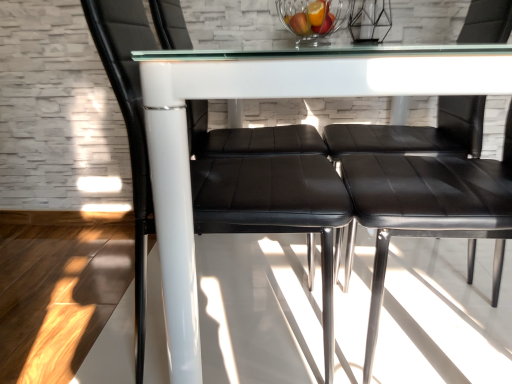
Question: Is transparent glass table at center directly adjacent to black leather chair at left, which is the second chair in right-to-left order?

Choices:
 (A) no
 (B) yes

Answer: (A)

Question: Does transparent glass table at center have a greater width compared to black leather chair at left, positioned as the first chair in left-to-right order?

Choices:
 (A) no
 (B) yes

Answer: (B)

Question: Does transparent glass table at center appear on the left side of black leather chair at left, which is the second chair in right-to-left order?

Choices:
 (A) no
 (B) yes

Answer: (A)

Question: Does transparent glass table at center turn towards black leather chair at left, which is the second chair in right-to-left order?

Choices:
 (A) yes
 (B) no

Answer: (A)

Question: From a real-world perspective, is transparent glass table at center located beneath black leather chair at left, positioned as the first chair in left-to-right order?

Choices:
 (A) yes
 (B) no

Answer: (A)

Question: Would you say clear glass bowl at upper center is to the left or to the right of black leather chair at center, which is the 1th chair from right to left, in the picture?

Choices:
 (A) right
 (B) left

Answer: (B)

Question: Is clear glass bowl at upper center inside the boundaries of black leather chair at center, positioned as the second chair in left-to-right order, or outside?

Choices:
 (A) inside
 (B) outside

Answer: (B)

Question: From the image's perspective, is clear glass bowl at upper center located above or below black leather chair at center, positioned as the second chair in left-to-right order?

Choices:
 (A) above
 (B) below

Answer: (A)

Question: In terms of size, does clear glass bowl at upper center appear bigger or smaller than black leather chair at center, which is the 1th chair from right to left?

Choices:
 (A) small
 (B) big

Answer: (A)

Question: From a real-world perspective, is transparent glass table at center above or below clear glass bowl at upper center?

Choices:
 (A) above
 (B) below

Answer: (B)

Question: Is point (197, 51) closer or farther from the camera than point (284, 1)?

Choices:
 (A) farther
 (B) closer

Answer: (B)

Question: Is transparent glass table at center bigger or smaller than clear glass bowl at upper center?

Choices:
 (A) big
 (B) small

Answer: (A)

Question: Looking at their shapes, would you say transparent glass table at center is wider or thinner than clear glass bowl at upper center?

Choices:
 (A) wide
 (B) thin

Answer: (A)

Question: Is transparent glass table at center bigger or smaller than black leather chair at left, which is the second chair in right-to-left order?

Choices:
 (A) big
 (B) small

Answer: (A)

Question: In the image, is transparent glass table at center positioned in front of or behind black leather chair at left, positioned as the first chair in left-to-right order?

Choices:
 (A) behind
 (B) front

Answer: (B)